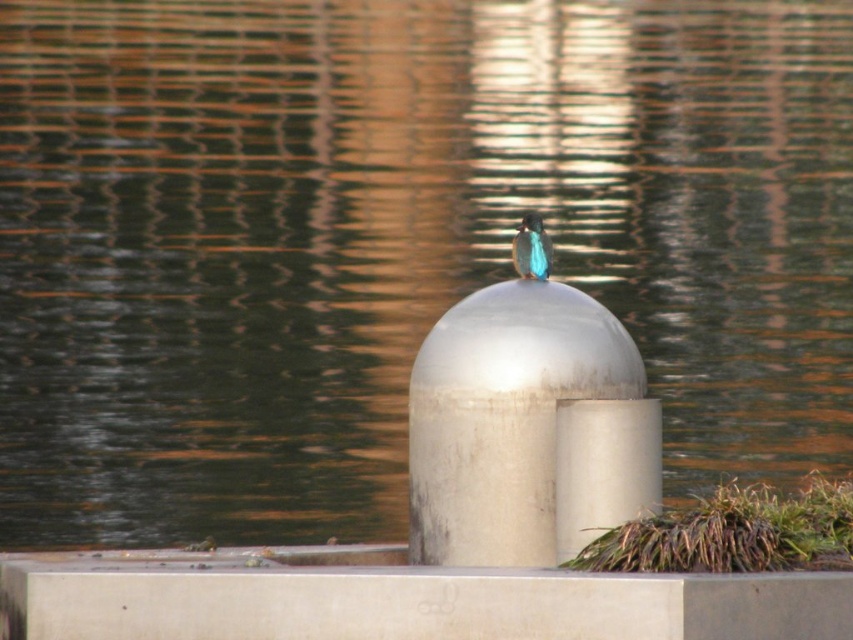
You are a photographer trying to capture a closeup of the blue glossy bird at center while keeping the satin silver dome at center in the background. Your camera has a depth of field that can focus on objects within a 20 inch range. Will both the bird and the dome be in focus?

The satin silver dome at center and blue glossy bird at center are 21.02 inches apart. Since the distance between them exceeds the camera lens depth of field range of 20 inches, the camera cannot keep both the satin silver dome at center and blue glossy bird at center in focus simultaneously.

You are a photographer trying to capture the blue glossy bird at center and the satin silver dome at center in a single frame. Based on their sizes, which object should you focus on first to ensure both are in the frame?

The satin silver dome at center is much taller than the blue glossy bird at center, so you should focus on the satin silver dome at center first to ensure both are in the frame.

You are a birdwatcher trying to capture a photo of the blue glossy bird at center. The bird is currently on the satin silver dome at center. If you want to ensure the bird is the main focus of your photo, which object should you zoom in on more?

You should zoom in more on the blue glossy bird at center because the satin silver dome at center is larger in size, so focusing on the smaller bird will make it the main subject.